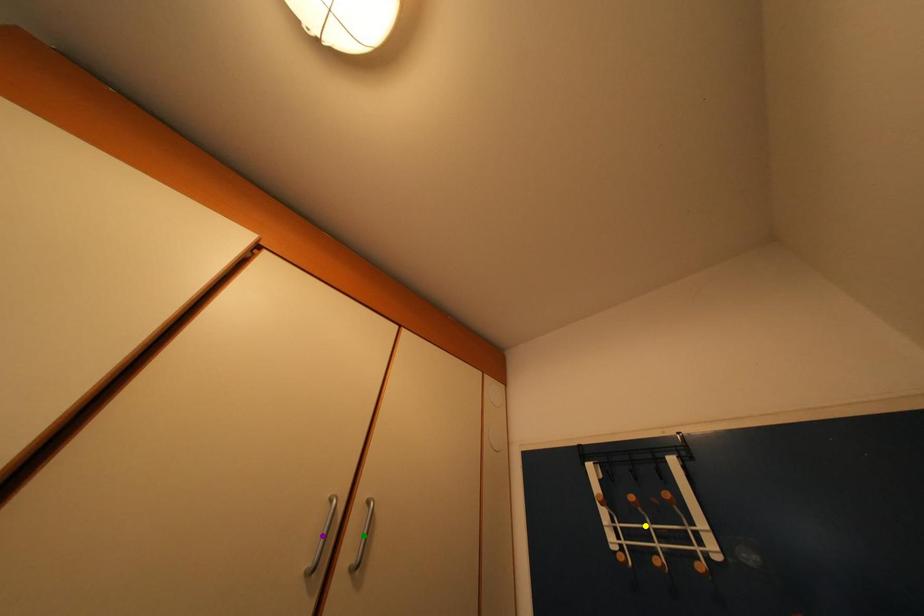
Order these from nearest to farthest:
yellow point, purple point, green point

purple point < green point < yellow point